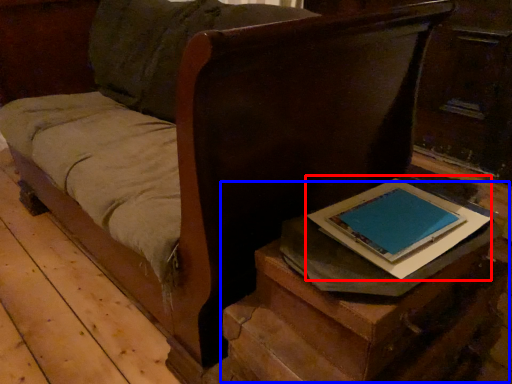
Question: Which object is closer to the camera taking this photo, paperback book (highlighted by a red box) or table (highlighted by a blue box)?

Choices:
 (A) paperback book
 (B) table

Answer: (B)